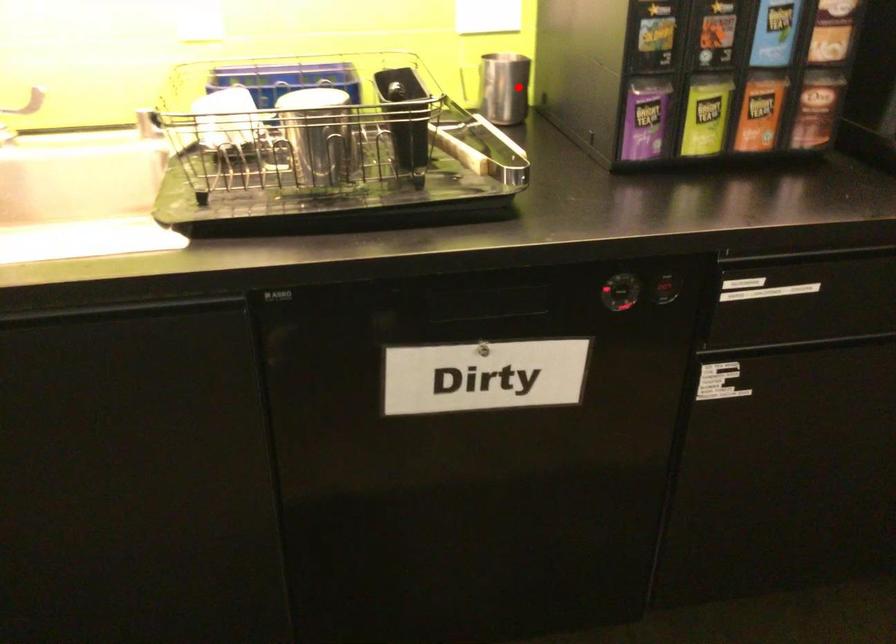
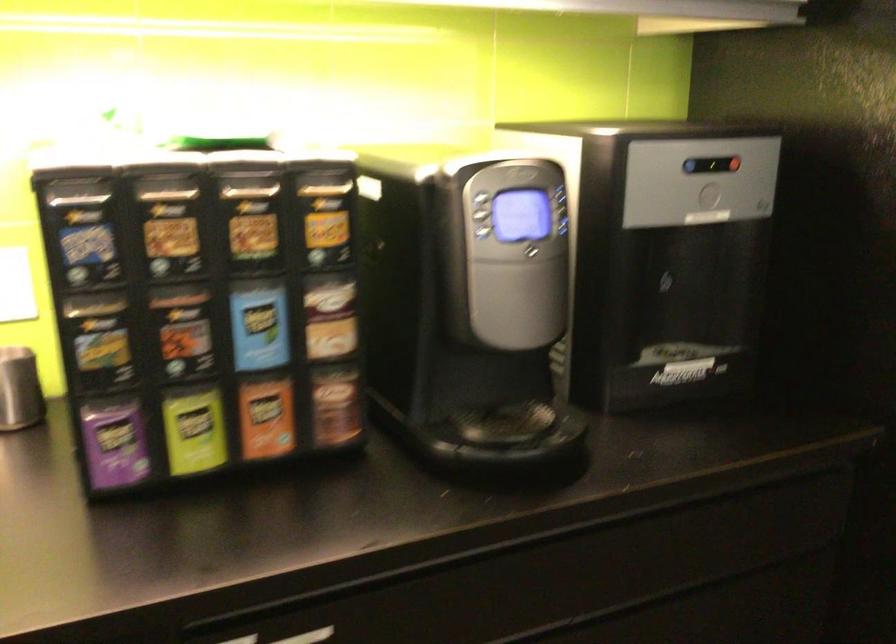
Question: I am providing you with two images of the same scene from different viewpoints. A red point is shown in image1. For the corresponding object point in image2, is it positioned nearer or farther from the camera?

Choices:
 (A) Nearer
 (B) Farther

Answer: (A)